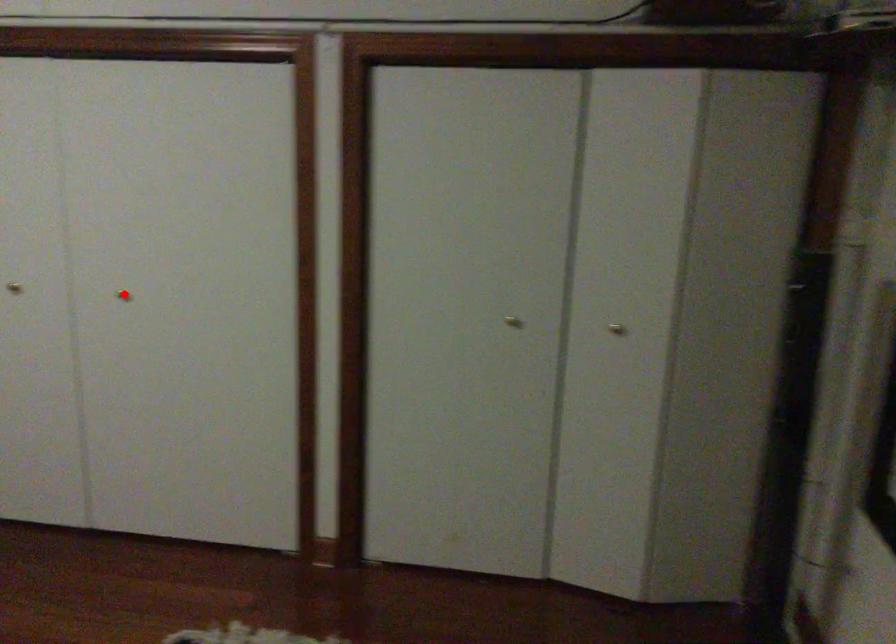
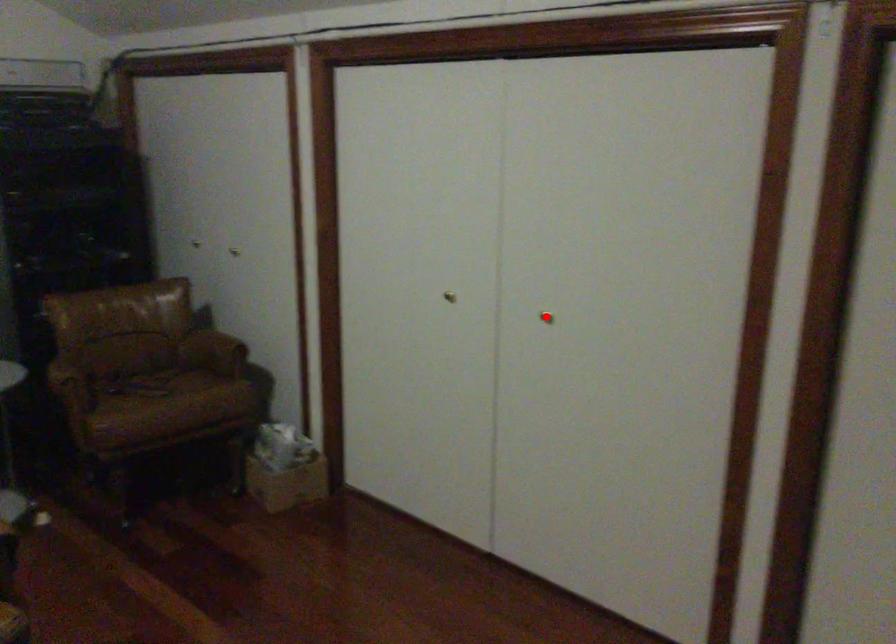
I am providing you with two images of the same scene from different viewpoints. A red point is marked on the first image and another point is marked on the second image. Does the point marked in image1 correspond to the same location as the one in image2?

Yes